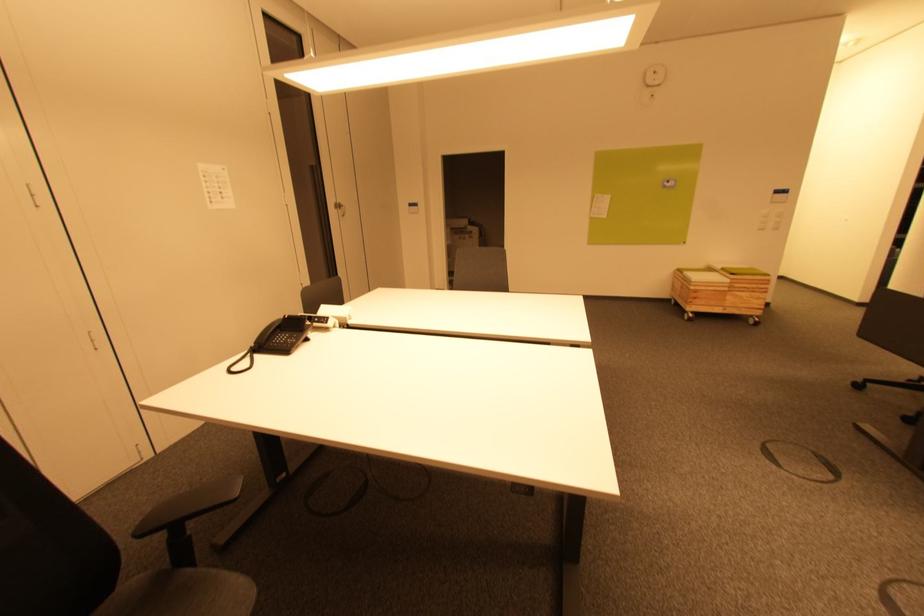
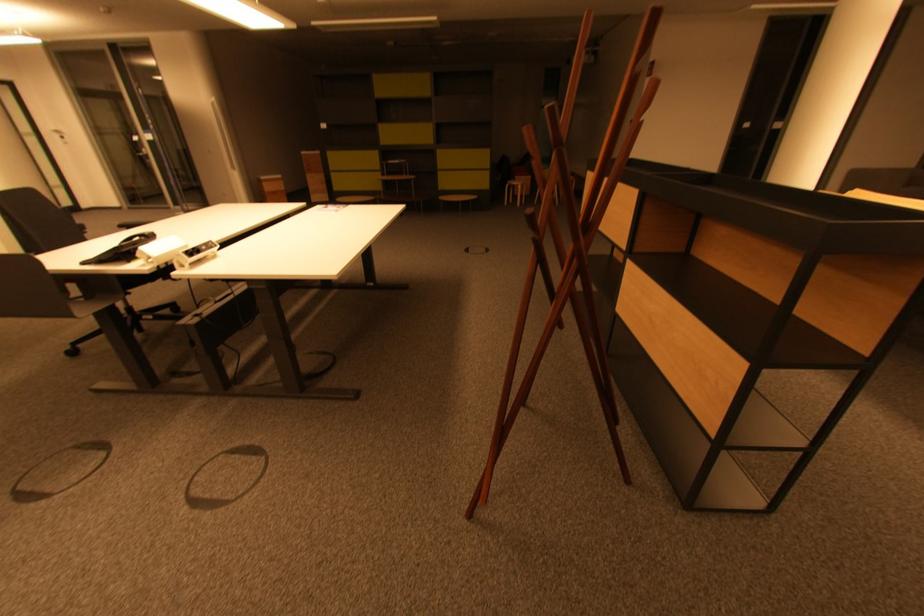
Based on the continuous images, in which direction is the camera rotating?

The camera's rotation is toward right-down.